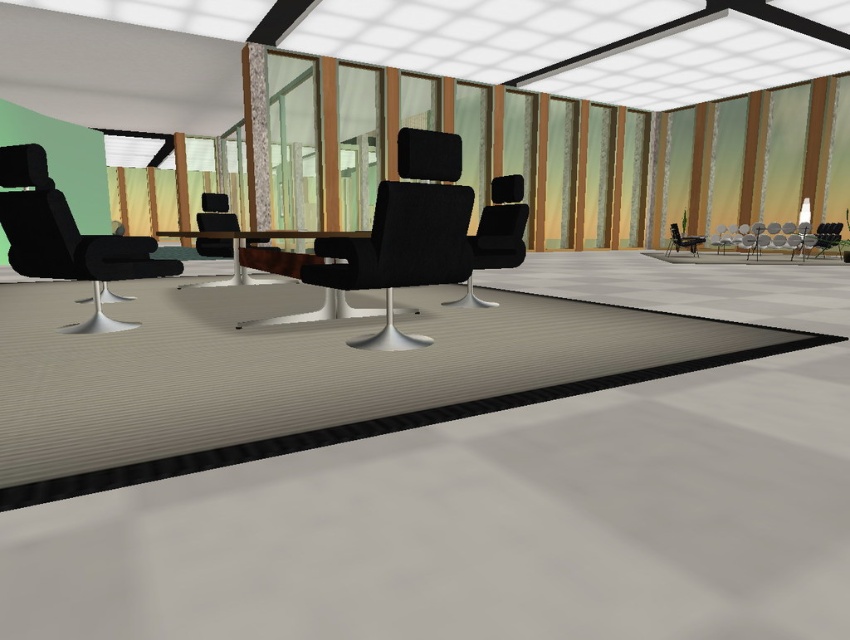
Question: Can you confirm if textured gray mat at center is wider than matte black chair at right?

Choices:
 (A) yes
 (B) no

Answer: (A)

Question: Which of the following is the closest to the observer?

Choices:
 (A) (518, 244)
 (B) (420, 131)
 (C) (561, 307)

Answer: (B)

Question: Estimate the real-world distances between objects in this image. Which object is closer to the matte black chair at center?

Choices:
 (A) matte black swivel chair at center
 (B) metallic silver chair at right

Answer: (A)

Question: Which of the following is the closest to the observer?

Choices:
 (A) (675, 243)
 (B) (507, 198)

Answer: (B)

Question: Is matte black swivel chair at center below matte black chair at right?

Choices:
 (A) yes
 (B) no

Answer: (A)

Question: Is the position of matte black swivel chair at center more distant than that of matte black chair at left?

Choices:
 (A) no
 (B) yes

Answer: (A)